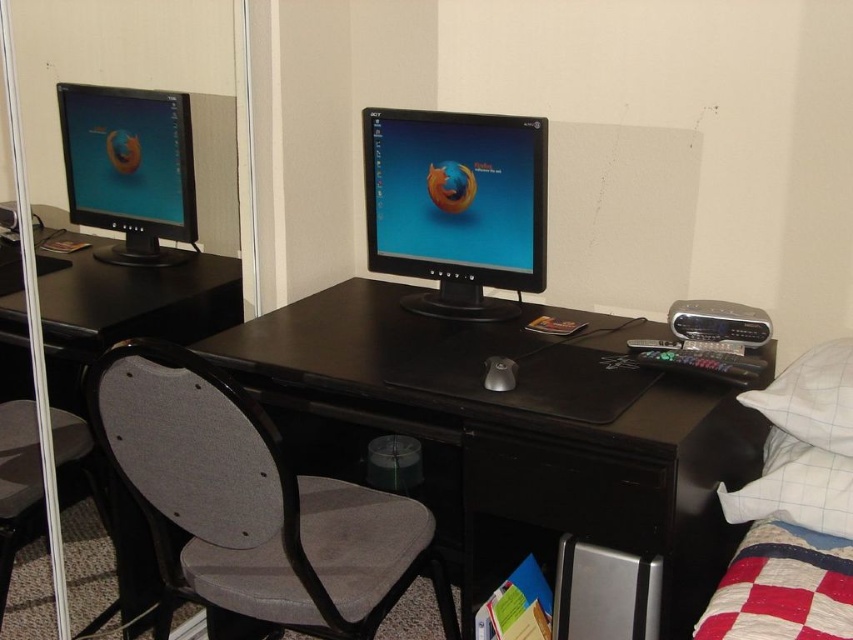
You are a delivery person who needs to place a rectangular package that measures 80 centimeters in length between the black glossy monitor at center and the matte black monitor at left on the desk. Can the package fit horizontally between them without overlapping either monitor?

The distance between the black glossy monitor at center and the matte black monitor at left is 82.84 centimeters. Since the package is 80 centimeters long, it can fit horizontally between them as there is enough space.

You are organizing the desk and need to place a new item exactly at point 0.677, 0.600. Where should you place it in relation to the black glossy monitor at center?

The black glossy monitor at center is located at point (511, 433), so you should place the new item directly on top of or in the same location as the black glossy monitor at center.